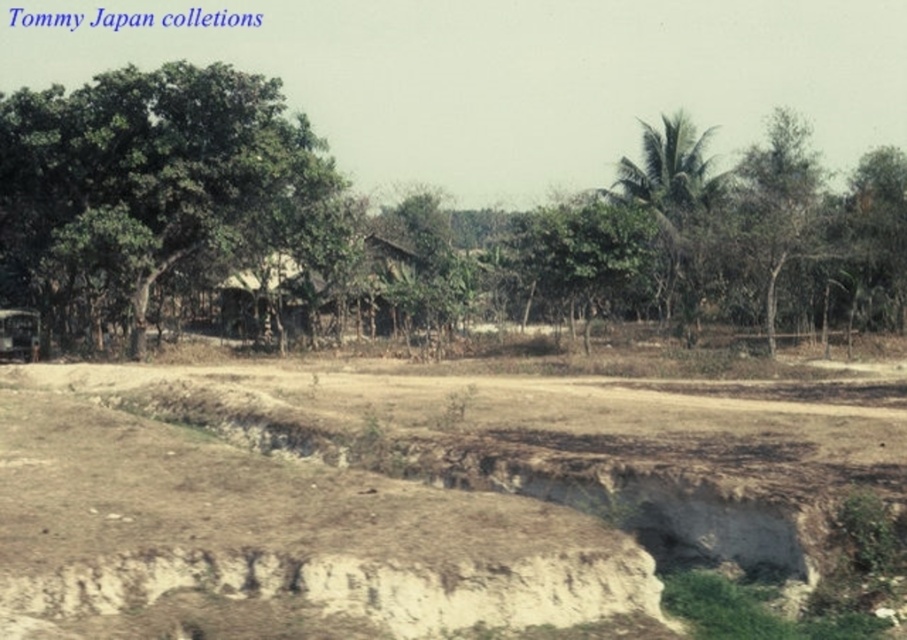
Question: Which of the following is the farthest from the observer?

Choices:
 (A) brown sandy dirt field at center
 (B) green leafy tree at upper right
 (C) green leafy tree at center

Answer: (B)

Question: Estimate the real-world distances between objects in this image. Which object is closer to the green leafy tree at left?

Choices:
 (A) brown wooden hut at center
 (B) green leafy tree at center
 (C) brown sandy dirt field at center
 (D) green leafy tree at upper right

Answer: (A)

Question: Based on their relative distances, which object is farther from the brown wooden hut at center?

Choices:
 (A) green leafy tree at left
 (B) green leafy tree at center
 (C) brown sandy dirt field at center

Answer: (C)

Question: Is green leafy tree at center below green leafy tree at upper right?

Choices:
 (A) no
 (B) yes

Answer: (B)

Question: Can you confirm if green leafy tree at center is thinner than green leafy tree at upper right?

Choices:
 (A) no
 (B) yes

Answer: (A)

Question: In this image, where is brown sandy dirt field at center located relative to green leafy tree at left?

Choices:
 (A) above
 (B) below

Answer: (B)